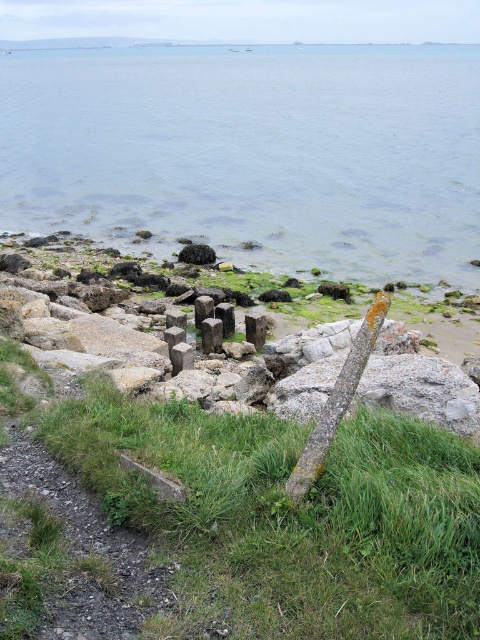
You are standing on the green grass at lower center and want to reach the brown mossy pole at center. Which direction should you move to get closer to the pole?

You should move upwards towards the brown mossy pole at center since the green grass at lower center is located below it.

You are standing on the green grass at lower center and want to step into the clear water at lower center. Based on the scene description, which direction should you move to reach the water?

Since the clear water at lower center has a greater height compared to the green grass at lower center, you should move towards the direction where the elevation increases. Therefore, you need to move upwards to reach the clear water at lower center.